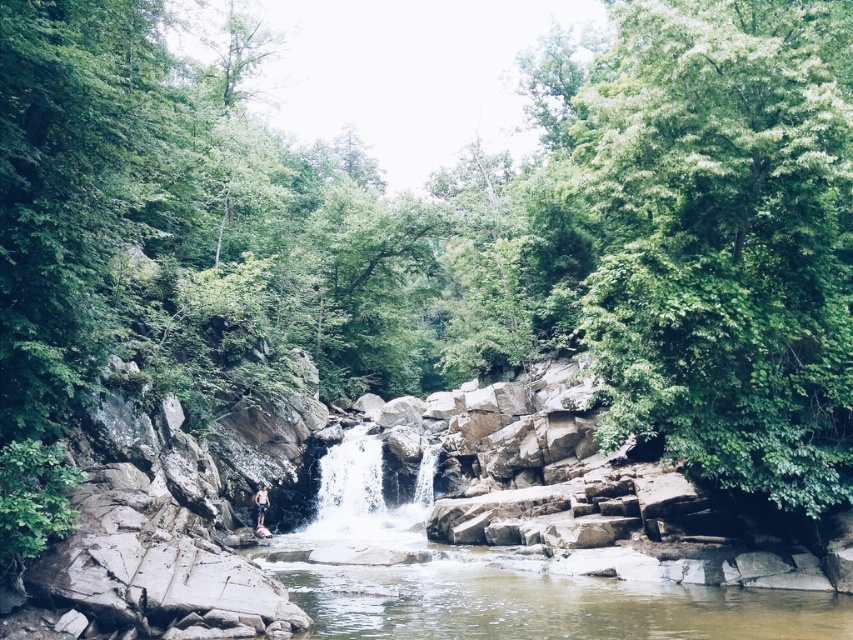
Question: Which point is farther to the camera?

Choices:
 (A) brown rock river at center
 (B) clear water at center

Answer: (B)

Question: Based on their relative distances, which object is farther from the tan shorts at center?

Choices:
 (A) brown rock river at center
 (B) clear water at center

Answer: (A)

Question: Can you confirm if clear water at center is thinner than tan shorts at center?

Choices:
 (A) yes
 (B) no

Answer: (B)

Question: Which of these objects is positioned farthest from the tan shorts at center?

Choices:
 (A) clear water at center
 (B) brown rock river at center

Answer: (B)

Question: Observing the image, what is the correct spatial positioning of brown rock river at center in reference to tan shorts at center?

Choices:
 (A) below
 (B) above

Answer: (B)

Question: Is brown rock river at center smaller than tan shorts at center?

Choices:
 (A) yes
 (B) no

Answer: (B)